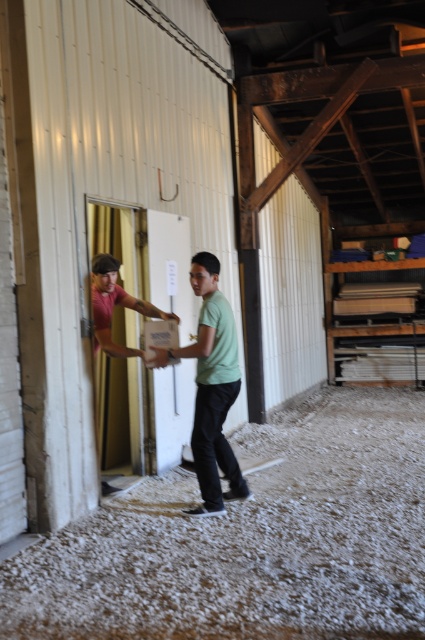
Is point (193, 428) positioned after point (119, 304)?

No, (193, 428) is closer to viewer.

Does green matte shirt at center have a smaller size compared to matte pink shirt at left?

Incorrect, green matte shirt at center is not smaller in size than matte pink shirt at left.

Identify the location of green matte shirt at center. The width and height of the screenshot is (425, 640). (212, 387).

Locate an element on the screen. green matte shirt at center is located at coordinates (212, 387).

Can you confirm if white gravel at lower center is positioned to the right of matte pink shirt at left?

Indeed, white gravel at lower center is positioned on the right side of matte pink shirt at left.

Who is more distant from viewer, [414,561] or [144,310]?

Positioned behind is point [144,310].

Does point (291, 611) come closer to viewer compared to point (108, 490)?

Yes.

Where is `white gravel at lower center`? Image resolution: width=425 pixels, height=640 pixels. white gravel at lower center is located at coordinates (251, 541).

Can you confirm if white gravel at lower center is positioned to the right of green matte shirt at center?

Indeed, white gravel at lower center is positioned on the right side of green matte shirt at center.

Identify the location of white gravel at lower center. The height and width of the screenshot is (640, 425). (251, 541).